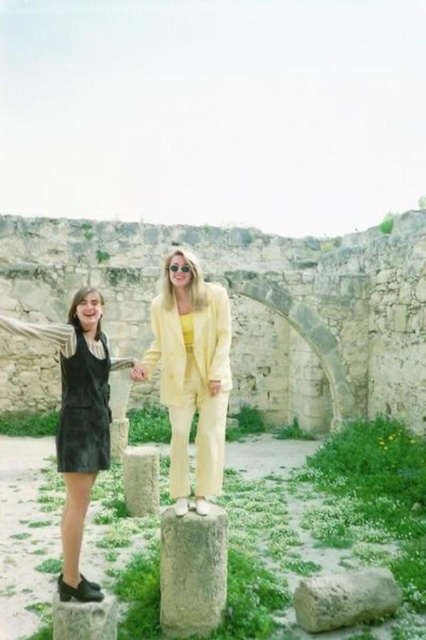
Question: Is gray stone pillar at center positioned in front of gray stone at center?

Choices:
 (A) no
 (B) yes

Answer: (B)

Question: Which of the following is the farthest from the observer?

Choices:
 (A) (146, 374)
 (B) (212, 515)
 (C) (68, 630)
 (D) (63, 596)

Answer: (A)

Question: Which object is closer to the camera taking this photo?

Choices:
 (A) smooth gray rock at lower center
 (B) gray stone at center

Answer: (A)

Question: Is stone archway at center further to camera compared to gray stone pillar at center?

Choices:
 (A) yes
 (B) no

Answer: (A)

Question: Does velvet black dress at left have a greater width compared to smooth gray stone at lower left?

Choices:
 (A) yes
 (B) no

Answer: (A)

Question: Which of the following is the farthest from the observer?

Choices:
 (A) linen yellow suit at center
 (B) smooth gray stone at lower left

Answer: (A)